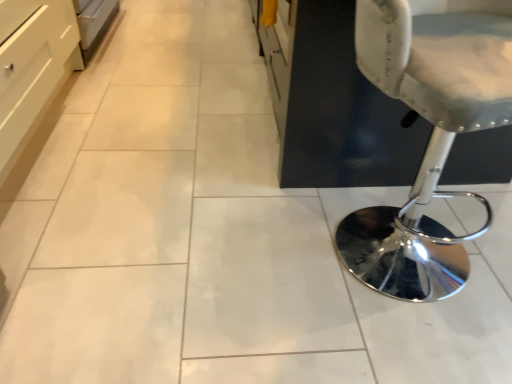
Where is `vacant area that is in front of white leather stool at right`? The image size is (512, 384). vacant area that is in front of white leather stool at right is located at coordinates (399, 335).